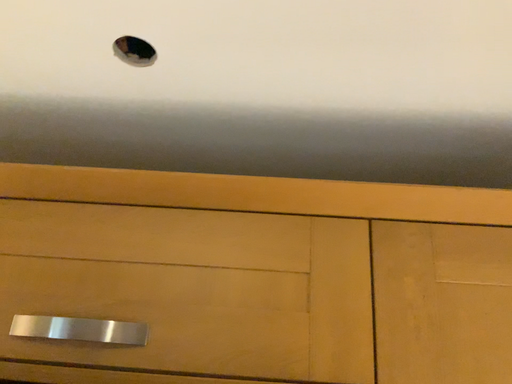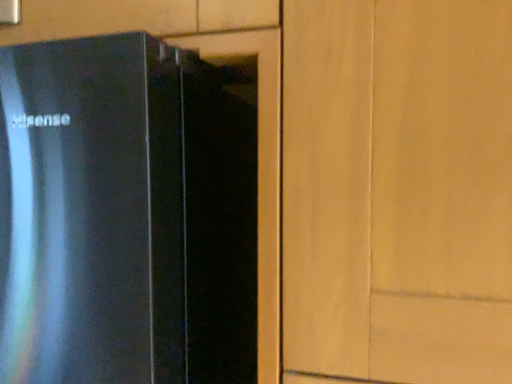
Question: Which way did the camera rotate in the video?

Choices:
 (A) rotated left
 (B) rotated right

Answer: (A)